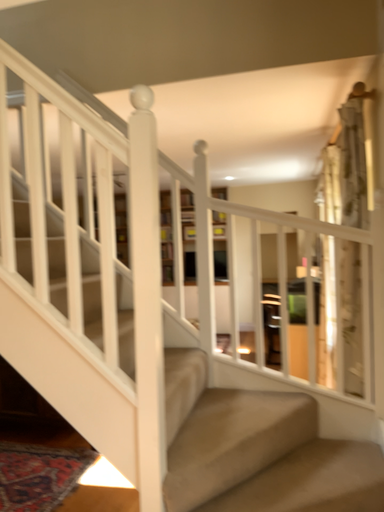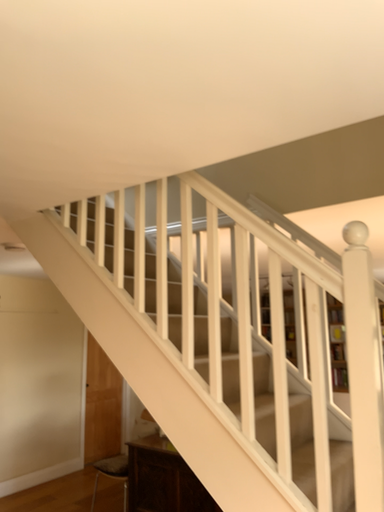
Question: How did the camera likely rotate when shooting the video?

Choices:
 (A) rotated upward
 (B) rotated downward

Answer: (A)